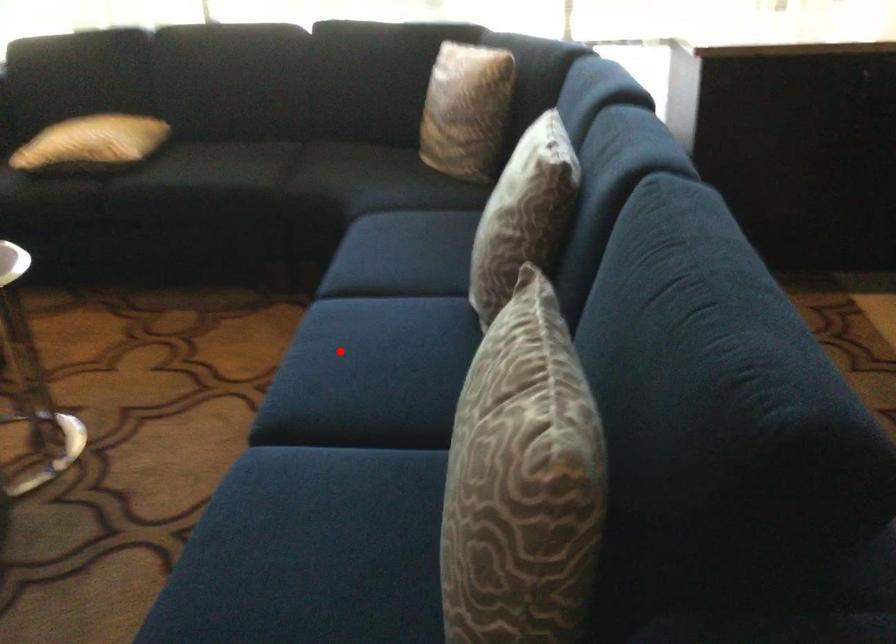
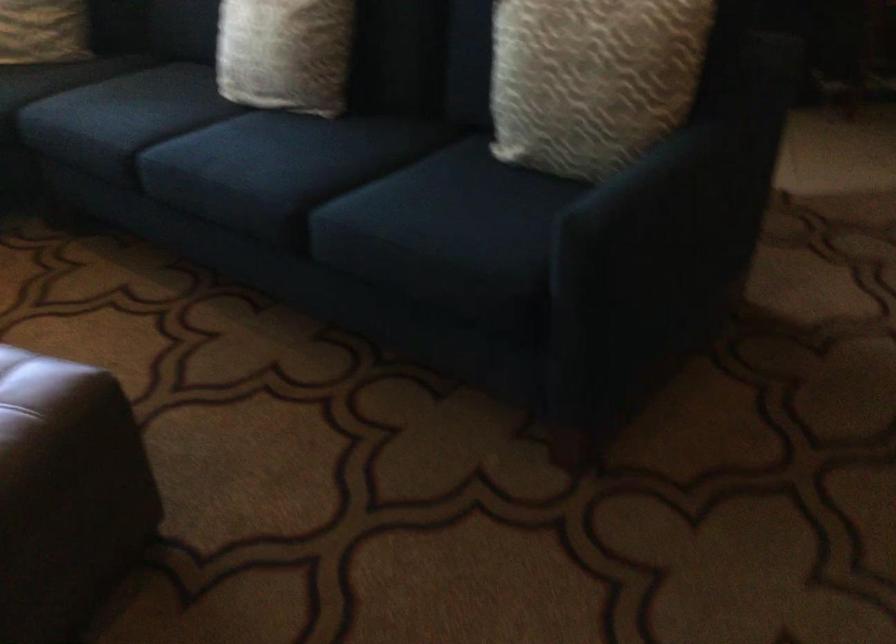
In the second image, find the point that corresponds to the highlighted location in the first image.

(245, 154)